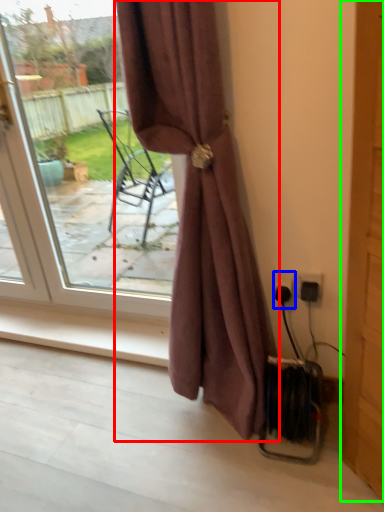
Question: Considering the real-world distances, which object is closest to curtain (highlighted by a red box)? electric outlet (highlighted by a blue box) or screen door (highlighted by a green box).

Choices:
 (A) electric outlet
 (B) screen door

Answer: (A)